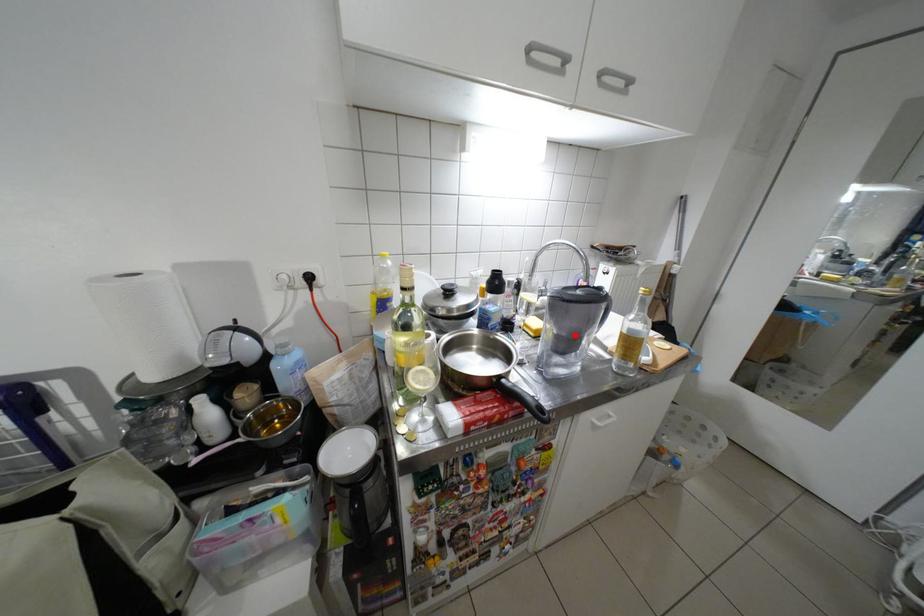
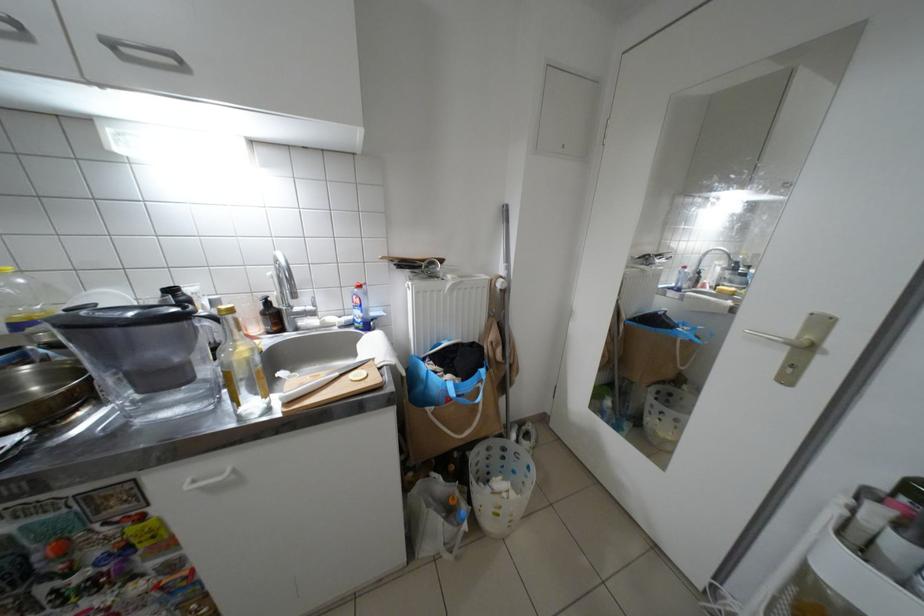
Where in the second image is the point corresponding to the highlighted location from the first image?

(139, 369)